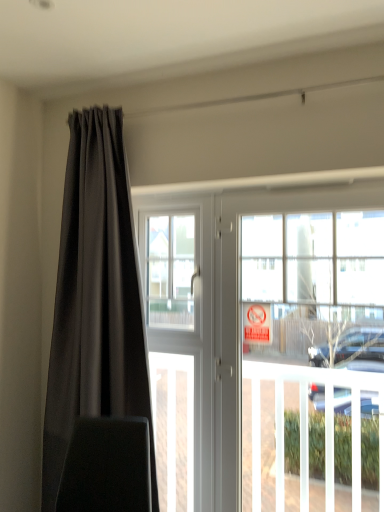
Locate an element on the screen. The image size is (384, 512). transparent glass window screen at center is located at coordinates pos(170,270).

Describe the element at coordinates (170, 270) in the screenshot. I see `transparent glass window screen at center` at that location.

The height and width of the screenshot is (512, 384). Describe the element at coordinates (95, 298) in the screenshot. I see `matte black curtain at left` at that location.

This screenshot has height=512, width=384. Find the location of `matte black curtain at left`. matte black curtain at left is located at coordinates (95, 298).

Where is `velvet black swivel chair at left`? Image resolution: width=384 pixels, height=512 pixels. velvet black swivel chair at left is located at coordinates (107, 466).

Where is `transparent glass window screen at center`? transparent glass window screen at center is located at coordinates (170, 270).

Is white glossy door at center at the right side of red plastic sign at window?

Yes, white glossy door at center is to the right of red plastic sign at window.

Image resolution: width=384 pixels, height=512 pixels. Identify the location of door below the red plastic sign at window (from the image's perspective). coord(270,344).

Is white glossy door at center next to red plastic sign at window?

There is a gap between white glossy door at center and red plastic sign at window.

From a real-world perspective, who is located lower, white glossy door at center or red plastic sign at window?

white glossy door at center is physically lower.

Locate an element on the screen. The width and height of the screenshot is (384, 512). swivel chair in front of the transparent glass window screen at center is located at coordinates (107, 466).

Would you say transparent glass window screen at center is part of velvet black swivel chair at left's contents?

No, transparent glass window screen at center is not surrounded by velvet black swivel chair at left.

From the picture: Is velvet black swivel chair at left beside transparent glass window screen at center?

No, velvet black swivel chair at left is not beside transparent glass window screen at center.

Does velvet black swivel chair at left have a lesser width compared to transparent glass window screen at center?

No.

Where is `door positioned vertically above the velvet black swivel chair at left (from a real-world perspective)`? The image size is (384, 512). door positioned vertically above the velvet black swivel chair at left (from a real-world perspective) is located at coordinates (270, 344).

Can you tell me how much velvet black swivel chair at left and white glossy door at center differ in facing direction?

They differ by 10.4 degrees in their facing directions.

Does velvet black swivel chair at left have a greater height compared to white glossy door at center?

Incorrect, the height of velvet black swivel chair at left is not larger of that of white glossy door at center.

Considering the points (92, 508) and (152, 324), which point is behind, point (92, 508) or point (152, 324)?

The point (152, 324) is more distant.

Which is behind, point (228, 249) or point (132, 216)?

The point (132, 216) is farther from the camera.

Does white glossy door at center appear on the right side of matte black curtain at left?

Correct, you'll find white glossy door at center to the right of matte black curtain at left.

Considering the relative sizes of white glossy door at center and matte black curtain at left in the image provided, is white glossy door at center smaller than matte black curtain at left?

Yes, white glossy door at center is smaller than matte black curtain at left.

Is transparent glass window screen at center taller than velvet black swivel chair at left?

Indeed, transparent glass window screen at center has a greater height compared to velvet black swivel chair at left.

From the image's perspective, is transparent glass window screen at center beneath velvet black swivel chair at left?

No.

Is transparent glass window screen at center not close to velvet black swivel chair at left?

transparent glass window screen at center is near velvet black swivel chair at left, not far away.

Is velvet black swivel chair at left located within transparent glass window screen at center?

No, velvet black swivel chair at left is located outside of transparent glass window screen at center.

Considering the relative sizes of white glossy door at center and transparent glass window screen at center in the image provided, is white glossy door at center bigger than transparent glass window screen at center?

Yes, white glossy door at center is bigger than transparent glass window screen at center.

Does white glossy door at center have a greater height compared to transparent glass window screen at center?

Yes.

Does white glossy door at center have a lesser width compared to transparent glass window screen at center?

In fact, white glossy door at center might be wider than transparent glass window screen at center.

Does velvet black swivel chair at left lie behind matte black curtain at left?

No, velvet black swivel chair at left is closer to the viewer.

Could you tell me if velvet black swivel chair at left is turned towards matte black curtain at left?

No, velvet black swivel chair at left is not aimed at matte black curtain at left.

Is velvet black swivel chair at left not inside matte black curtain at left?

That's correct, velvet black swivel chair at left is outside of matte black curtain at left.

From the image's perspective, who appears lower, velvet black swivel chair at left or matte black curtain at left?

velvet black swivel chair at left appears lower in the image.

Identify the location of door located below the red plastic sign at window (from the image's perspective). (270, 344).

You are a GUI agent. You are given a task and a screenshot of the screen. Output one action in this format:
    pyautogui.click(x=<x>, y=<y>)
    Task: Click on the swivel chair in front of the transparent glass window screen at center
    
    Given the screenshot: What is the action you would take?
    point(107,466)

When comparing their distances from white glossy door at center, does transparent glass window screen at center or velvet black swivel chair at left seem further?

Based on the image, velvet black swivel chair at left appears to be further to white glossy door at center.

When comparing their distances from matte black curtain at left, does red plastic sign at window or transparent glass window screen at center seem closer?

Based on the image, transparent glass window screen at center appears to be nearer to matte black curtain at left.

Looking at the image, which one is located further to velvet black swivel chair at left, white glossy door at center or matte black curtain at left?

white glossy door at center is positioned further to the anchor velvet black swivel chair at left.

When comparing their distances from transparent glass window screen at center, does velvet black swivel chair at left or white glossy door at center seem closer?

white glossy door at center is positioned closer to the anchor transparent glass window screen at center.

Looking at the image, which one is located closer to velvet black swivel chair at left, transparent glass window screen at center or matte black curtain at left?

Among the two, matte black curtain at left is located nearer to velvet black swivel chair at left.

From the picture: Estimate the real-world distances between objects in this image. Which object is further from transparent glass window screen at center, velvet black swivel chair at left or matte black curtain at left?

Among the two, velvet black swivel chair at left is located further to transparent glass window screen at center.

When comparing their distances from red plastic sign at window, does velvet black swivel chair at left or transparent glass window screen at center seem closer?

transparent glass window screen at center is positioned closer to the anchor red plastic sign at window.

Considering their positions, is velvet black swivel chair at left positioned closer to white glossy door at center than matte black curtain at left?

matte black curtain at left is positioned closer to the anchor white glossy door at center.

The height and width of the screenshot is (512, 384). Find the location of `parking sign between velvet black swivel chair at left and transparent glass window screen at center from front to back`. parking sign between velvet black swivel chair at left and transparent glass window screen at center from front to back is located at coordinates (257, 323).

Where is `window screen situated between matte black curtain at left and red plastic sign at window from left to right`? window screen situated between matte black curtain at left and red plastic sign at window from left to right is located at coordinates click(x=170, y=270).

Locate an element on the screen. This screenshot has width=384, height=512. door between velvet black swivel chair at left and transparent glass window screen at center in the front-back direction is located at coordinates (270, 344).

I want to click on door between velvet black swivel chair at left and red plastic sign at window from front to back, so click(x=270, y=344).